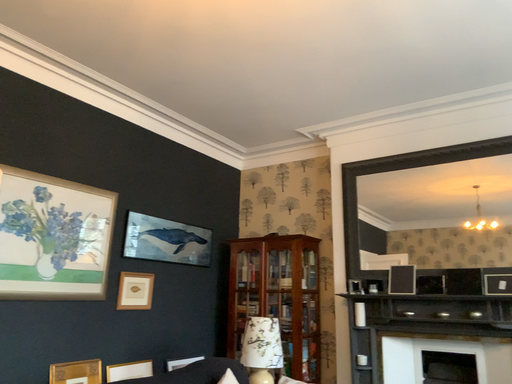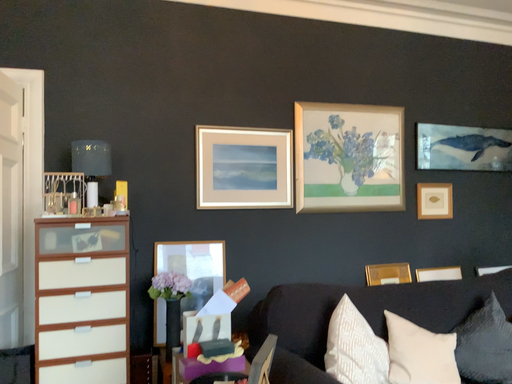
Question: Which way did the camera rotate in the video?

Choices:
 (A) rotated downward
 (B) rotated upward

Answer: (A)